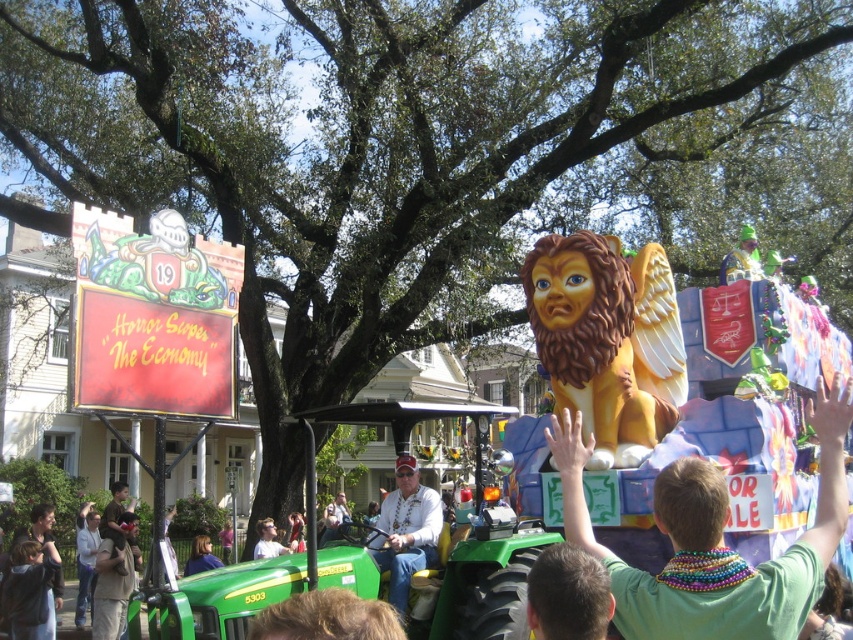
Which is below, green jersey at center or golden matte lion at center?

Positioned lower is green jersey at center.

Is green jersey at center bigger than golden matte lion at center?

Indeed, green jersey at center has a larger size compared to golden matte lion at center.

Which is behind, point (575, 451) or point (569, 364)?

Point (569, 364)

Locate an element on the screen. The height and width of the screenshot is (640, 853). green jersey at center is located at coordinates (712, 541).

Does matte white shirt at center have a greater height compared to light brown leather jacket at center?

Correct, matte white shirt at center is much taller as light brown leather jacket at center.

Which is behind, point (387, 493) or point (268, 556)?

Positioned behind is point (268, 556).

Does point (396, 552) come closer to viewer compared to point (260, 532)?

Yes, it is.

The image size is (853, 640). Find the location of `matte white shirt at center`. matte white shirt at center is located at coordinates pos(405,531).

Can you confirm if green jersey at center is positioned to the left of light brown leather jacket at center?

In fact, green jersey at center is to the right of light brown leather jacket at center.

Does green jersey at center have a greater height compared to light brown leather jacket at center?

Yes, green jersey at center is taller than light brown leather jacket at center.

Is point (753, 620) more distant than point (268, 532)?

No, it is not.

Where is `green jersey at center`? Image resolution: width=853 pixels, height=640 pixels. green jersey at center is located at coordinates (712, 541).